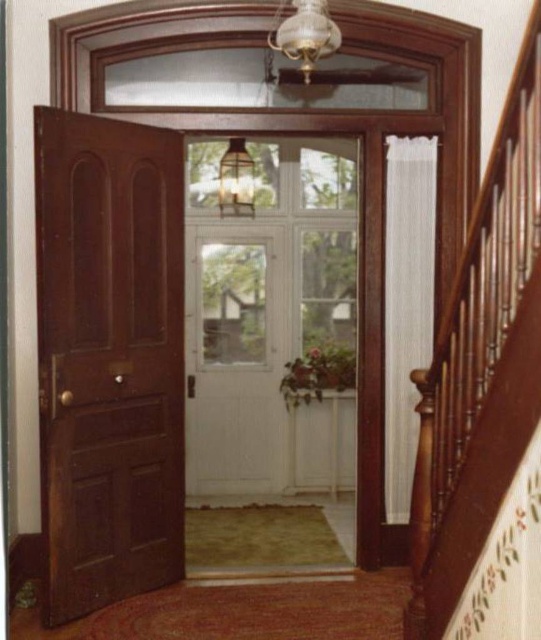
Does shiny dark wood door at left appear over white wood door at center?

Correct, shiny dark wood door at left is located above white wood door at center.

Image resolution: width=541 pixels, height=640 pixels. What do you see at coordinates (108, 358) in the screenshot?
I see `shiny dark wood door at left` at bounding box center [108, 358].

Image resolution: width=541 pixels, height=640 pixels. What do you see at coordinates (108, 358) in the screenshot? I see `shiny dark wood door at left` at bounding box center [108, 358].

Image resolution: width=541 pixels, height=640 pixels. Identify the location of shiny dark wood door at left. (108, 358).

Which of these two, wooden stair rail at right or white wood door at center, stands taller?

Standing taller between the two is wooden stair rail at right.

Where is `wooden stair rail at right`? wooden stair rail at right is located at coordinates (481, 362).

Is shiny dark wood door at left wider than wooden stair rail at right?

Yes, shiny dark wood door at left is wider than wooden stair rail at right.

Can you confirm if shiny dark wood door at left is positioned above wooden stair rail at right?

Correct, shiny dark wood door at left is located above wooden stair rail at right.

Who is more forward, (x=101, y=136) or (x=438, y=563)?

Point (x=438, y=563) is in front.

This screenshot has height=640, width=541. Find the location of `shiny dark wood door at left`. shiny dark wood door at left is located at coordinates [x=108, y=358].